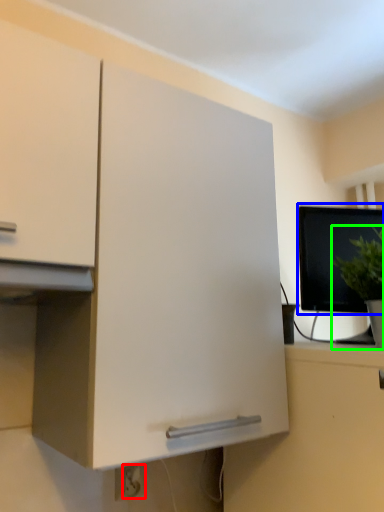
Question: Which object is the farthest from electric outlet (highlighted by a red box)? Choose among these: computer monitor (highlighted by a blue box) or houseplant (highlighted by a green box).

Choices:
 (A) computer monitor
 (B) houseplant

Answer: (A)